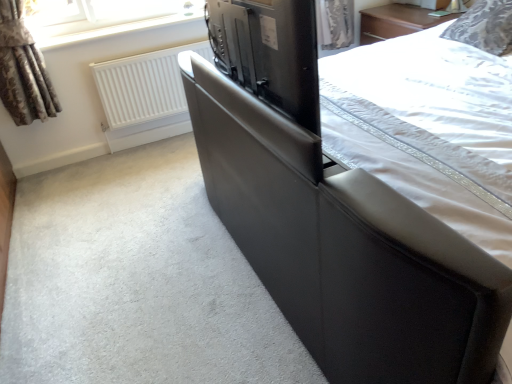
Question: Is matte black tv at center oriented away from black leather bed at center?

Choices:
 (A) no
 (B) yes

Answer: (B)

Question: Is black leather bed at center completely or partially inside matte black tv at center?

Choices:
 (A) yes
 (B) no

Answer: (B)

Question: Are matte black tv at center and black leather bed at center making contact?

Choices:
 (A) no
 (B) yes

Answer: (A)

Question: Considering the relative positions of matte black tv at center and black leather bed at center in the image provided, is matte black tv at center behind black leather bed at center?

Choices:
 (A) no
 (B) yes

Answer: (B)

Question: Can you confirm if matte black tv at center is shorter than black leather bed at center?

Choices:
 (A) yes
 (B) no

Answer: (A)

Question: Is matte black tv at center to the left of black leather bed at center from the viewer's perspective?

Choices:
 (A) no
 (B) yes

Answer: (B)

Question: Is white matte radiator at upper left at the right side of patterned fabric pillow at upper right?

Choices:
 (A) no
 (B) yes

Answer: (A)

Question: Is white matte radiator at upper left wider than patterned fabric pillow at upper right?

Choices:
 (A) yes
 (B) no

Answer: (B)

Question: Is white matte radiator at upper left in front of patterned fabric pillow at upper right?

Choices:
 (A) no
 (B) yes

Answer: (A)

Question: Considering the relative sizes of white matte radiator at upper left and patterned fabric pillow at upper right in the image provided, is white matte radiator at upper left smaller than patterned fabric pillow at upper right?

Choices:
 (A) no
 (B) yes

Answer: (B)

Question: Can you confirm if white matte radiator at upper left is taller than patterned fabric pillow at upper right?

Choices:
 (A) no
 (B) yes

Answer: (B)

Question: Does white matte radiator at upper left have a lesser width compared to patterned fabric pillow at upper right?

Choices:
 (A) no
 (B) yes

Answer: (B)

Question: Does matte black tv at center have a greater height compared to white matte radiator at upper left?

Choices:
 (A) yes
 (B) no

Answer: (B)